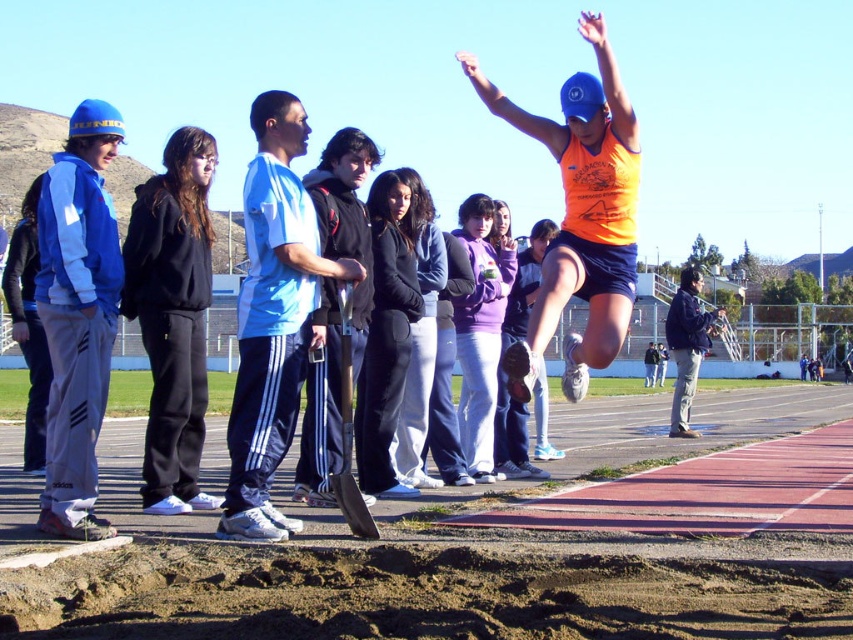
You are an athlete preparing to long jump. You see the brown sandy dirt track at lower center and the blue athletic wear at center. Which object is located lower in the image?

The brown sandy dirt track at lower center is located lower than the blue athletic wear at center in the image.

You are a photographer at the track and field event. You want to take a photo that includes both the blue athletic wear at center and the black fabric jacket at center. Which object should you focus on first to ensure both are in frame?

The blue athletic wear at center is taller than the black fabric jacket at center, so you should focus on the blue athletic wear at center first to ensure both are in frame.